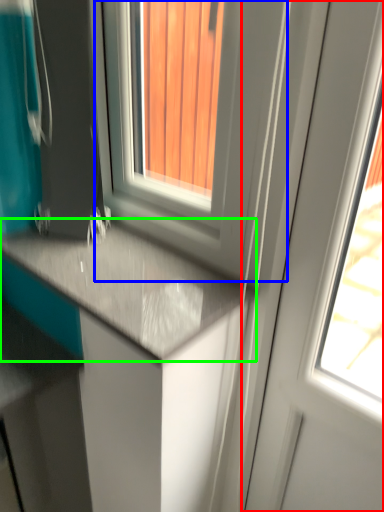
Question: Which object is positioned farthest from screen door (highlighted by a red box)? Select from window (highlighted by a blue box) and countertop (highlighted by a green box).

Choices:
 (A) window
 (B) countertop

Answer: (B)